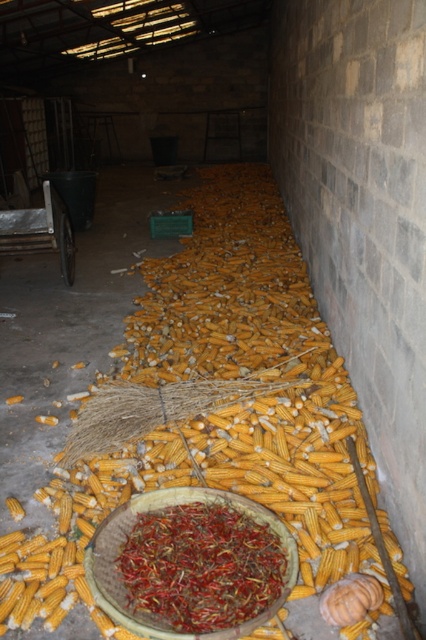
Can you confirm if yellow matte corn at center is positioned to the right of metallic silver cart at left?

Correct, you'll find yellow matte corn at center to the right of metallic silver cart at left.

Does point (367, 547) lie behind point (60, 228)?

No, (367, 547) is in front of (60, 228).

Image resolution: width=426 pixels, height=640 pixels. I want to click on yellow matte corn at center, so click(x=299, y=467).

You are a GUI agent. You are given a task and a screenshot of the screen. Output one action in this format:
    pyautogui.click(x=<x>, y=<y>)
    Task: Click on the yellow matte corn at center
    Image resolution: width=426 pixels, height=640 pixels.
    Given the screenshot: What is the action you would take?
    pyautogui.click(x=299, y=467)

Is red dried chili at center further to the viewer compared to metallic silver cart at left?

No, red dried chili at center is closer to the viewer.

Who is taller, red dried chili at center or metallic silver cart at left?

metallic silver cart at left is taller.

The width and height of the screenshot is (426, 640). What do you see at coordinates (201, 566) in the screenshot?
I see `red dried chili at center` at bounding box center [201, 566].

Where is `red dried chili at center`? This screenshot has width=426, height=640. red dried chili at center is located at coordinates (201, 566).

Does yellow matte corn at center have a greater width compared to red dried chili at center?

Incorrect, yellow matte corn at center's width does not surpass red dried chili at center's.

Does yellow matte corn at center come behind red dried chili at center?

Yes, yellow matte corn at center is behind red dried chili at center.

You are a GUI agent. You are given a task and a screenshot of the screen. Output one action in this format:
    pyautogui.click(x=<x>, y=<y>)
    Task: Click on the yellow matte corn at center
    
    Given the screenshot: What is the action you would take?
    pos(299,467)

Where is `yellow matte corn at center`? The image size is (426, 640). yellow matte corn at center is located at coordinates (299, 467).